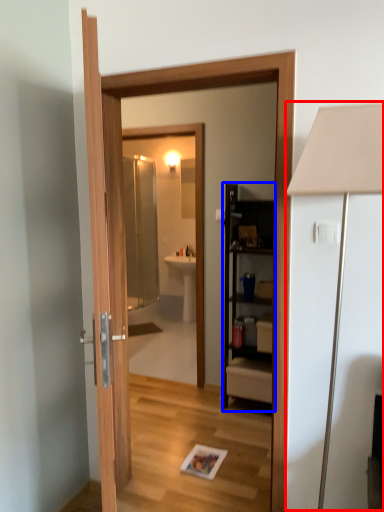
Question: Which object appears farthest to the camera in this image, table lamp (highlighted by a red box) or cabinetry (highlighted by a blue box)?

Choices:
 (A) table lamp
 (B) cabinetry

Answer: (B)